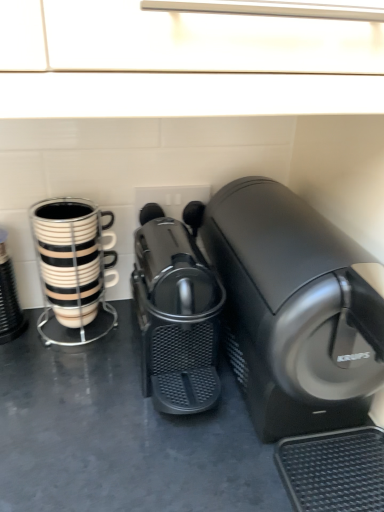
The image size is (384, 512). Find the location of `black glossy coffee cup at left`. black glossy coffee cup at left is located at coordinates (9, 298).

Identify the location of black and white striped mug at left. The height and width of the screenshot is (512, 384). (69, 259).

Based on the photo, how much space does black plastic coffee machine at center, which ranks as the 2th home appliance in right-to-left order, occupy horizontally?

12.50 inches.

The width and height of the screenshot is (384, 512). Identify the location of black glossy coffee cup at left. (9, 298).

Considering the sizes of objects black glossy coffee cup at left and black plastic coffee machine at center, which ranks as the 2th home appliance in right-to-left order, in the image provided, who is bigger, black glossy coffee cup at left or black plastic coffee machine at center, which ranks as the 2th home appliance in right-to-left order,?

Bigger between the two is black plastic coffee machine at center, which ranks as the 2th home appliance in right-to-left order.

Is black glossy coffee cup at left thinner than black plastic coffee machine at center, which ranks as the 2th home appliance in right-to-left order?

Yes.

Considering the points (6, 309) and (191, 359), which point is in front, point (6, 309) or point (191, 359)?

Point (191, 359)

Find the location of a particular element. The height and width of the screenshot is (512, 384). home appliance that is the 1st one above the black glossy coffee cup at left (from a real-world perspective) is located at coordinates (176, 312).

Would you say black plastic coffee machine at center, which ranks as the 2th home appliance in right-to-left order, is outside black plastic coffee machine at center, marked as the first home appliance in a right-to-left arrangement?

Yes, black plastic coffee machine at center, which ranks as the 2th home appliance in right-to-left order, is outside of black plastic coffee machine at center, marked as the first home appliance in a right-to-left arrangement.

Is black plastic coffee machine at center, which ranks as the 2th home appliance in right-to-left order, bigger or smaller than black plastic coffee machine at center, marked as the first home appliance in a right-to-left arrangement?

In the image, black plastic coffee machine at center, which ranks as the 2th home appliance in right-to-left order, appears to be smaller than black plastic coffee machine at center, marked as the first home appliance in a right-to-left arrangement.

Which point is more forward, (212, 289) or (348, 398)?

Positioned in front is point (348, 398).

Based on their positions, is black plastic coffee machine at center, which ranks as the 2th home appliance in right-to-left order, located to the left or right of black plastic coffee machine at center, the 2th home appliance positioned from the left?

black plastic coffee machine at center, which ranks as the 2th home appliance in right-to-left order, is to the left of black plastic coffee machine at center, the 2th home appliance positioned from the left.

From the picture: From the image's perspective, is black plastic coffee machine at center, which ranks as the 2th home appliance in right-to-left order, above or below black and white striped mug at left?

Clearly, from the image's perspective, black plastic coffee machine at center, which ranks as the 2th home appliance in right-to-left order, is below black and white striped mug at left.

From the picture: Considering the relative sizes of black plastic coffee machine at center, which ranks as the 2th home appliance in right-to-left order, and black and white striped mug at left in the image provided, is black plastic coffee machine at center, which ranks as the 2th home appliance in right-to-left order, thinner than black and white striped mug at left?

In fact, black plastic coffee machine at center, which ranks as the 2th home appliance in right-to-left order, might be wider than black and white striped mug at left.

At what (x,y) coordinates should I click in order to perform the action: click on coffee cup behind the black plastic coffee machine at center, the 1th home appliance in the left-to-right sequence. Please return your answer as a coordinate pair (x, y). Looking at the image, I should click on click(69, 259).

Is point (3, 319) positioned behind point (65, 218)?

Yes, it is.

Based on their sizes in the image, would you say black glossy coffee cup at left is bigger or smaller than black and white striped mug at left?

black glossy coffee cup at left is smaller than black and white striped mug at left.

Consider the image. From a real-world perspective, is black glossy coffee cup at left physically below black and white striped mug at left?

Yes, from a real-world perspective, black glossy coffee cup at left is below black and white striped mug at left.

Which is more to the right, black glossy coffee cup at left or black and white striped mug at left?

black and white striped mug at left.

From the image's perspective, relative to black plastic coffee machine at center, the 1th home appliance in the left-to-right sequence, is black and white striped mug at left above or below?

Clearly, from the image's perspective, black and white striped mug at left is above black plastic coffee machine at center, the 1th home appliance in the left-to-right sequence.

From a real-world perspective, does black and white striped mug at left sit lower than black plastic coffee machine at center, which ranks as the 2th home appliance in right-to-left order?

Correct, in the physical world, black and white striped mug at left is lower than black plastic coffee machine at center, which ranks as the 2th home appliance in right-to-left order.

Considering the relative positions of black and white striped mug at left and black plastic coffee machine at center, which ranks as the 2th home appliance in right-to-left order, in the image provided, is black and white striped mug at left to the right of black plastic coffee machine at center, which ranks as the 2th home appliance in right-to-left order, from the viewer's perspective?

Incorrect, black and white striped mug at left is not on the right side of black plastic coffee machine at center, which ranks as the 2th home appliance in right-to-left order.

Based on the photo, considering the sizes of objects black and white striped mug at left and black plastic coffee machine at center, the 1th home appliance in the left-to-right sequence, in the image provided, who is wider, black and white striped mug at left or black plastic coffee machine at center, the 1th home appliance in the left-to-right sequence,?

With larger width is black plastic coffee machine at center, the 1th home appliance in the left-to-right sequence.

Which is in front, point (95, 263) or point (6, 307)?

The point (95, 263) is more forward.

Locate an element on the screen. The image size is (384, 512). appliance to the left of black and white striped mug at left is located at coordinates (9, 298).

Can you confirm if black and white striped mug at left is thinner than black glossy coffee cup at left?

Correct, the width of black and white striped mug at left is less than that of black glossy coffee cup at left.

Does black and white striped mug at left have a lesser height compared to black glossy coffee cup at left?

Incorrect, the height of black and white striped mug at left does not fall short of that of black glossy coffee cup at left.

From the image's perspective, who appears lower, black plastic coffee machine at center, marked as the first home appliance in a right-to-left arrangement, or black glossy coffee cup at left?

black glossy coffee cup at left.

From a real-world perspective, is black plastic coffee machine at center, the 2th home appliance positioned from the left, positioned over black glossy coffee cup at left based on gravity?

Yes.

Does point (344, 419) appear closer or farther from the camera than point (4, 318)?

Point (344, 419) is closer to the camera than point (4, 318).

Considering the sizes of objects black plastic coffee machine at center, the 2th home appliance positioned from the left, and black glossy coffee cup at left in the image provided, who is smaller, black plastic coffee machine at center, the 2th home appliance positioned from the left, or black glossy coffee cup at left?

Smaller between the two is black glossy coffee cup at left.

This screenshot has height=512, width=384. Find the location of `home appliance below the black glossy coffee cup at left (from the image's perspective)`. home appliance below the black glossy coffee cup at left (from the image's perspective) is located at coordinates (176, 312).

Where is `home appliance that appears above the black plastic coffee machine at center, the 1th home appliance in the left-to-right sequence (from a real-world perspective)`? The width and height of the screenshot is (384, 512). home appliance that appears above the black plastic coffee machine at center, the 1th home appliance in the left-to-right sequence (from a real-world perspective) is located at coordinates (303, 339).

Which object lies nearer to the anchor point black glossy coffee cup at left, black plastic coffee machine at center, marked as the first home appliance in a right-to-left arrangement, or black and white striped mug at left?

black and white striped mug at left is positioned closer to the anchor black glossy coffee cup at left.

Looking at the image, which one is located closer to black plastic coffee machine at center, the 2th home appliance positioned from the left, black plastic coffee machine at center, the 1th home appliance in the left-to-right sequence, or black and white striped mug at left?

black plastic coffee machine at center, the 1th home appliance in the left-to-right sequence.

Looking at the image, which one is located further to black plastic coffee machine at center, the 2th home appliance positioned from the left, black and white striped mug at left or black plastic coffee machine at center, the 1th home appliance in the left-to-right sequence?

The object further to black plastic coffee machine at center, the 2th home appliance positioned from the left, is black and white striped mug at left.

When comparing their distances from black glossy coffee cup at left, does black and white striped mug at left or black plastic coffee machine at center, which ranks as the 2th home appliance in right-to-left order, seem closer?

black and white striped mug at left is positioned closer to the anchor black glossy coffee cup at left.

Which object lies nearer to the anchor point black plastic coffee machine at center, which ranks as the 2th home appliance in right-to-left order, black plastic coffee machine at center, marked as the first home appliance in a right-to-left arrangement, or black and white striped mug at left?

Based on the image, black plastic coffee machine at center, marked as the first home appliance in a right-to-left arrangement, appears to be nearer to black plastic coffee machine at center, which ranks as the 2th home appliance in right-to-left order.

Considering their positions, is black plastic coffee machine at center, marked as the first home appliance in a right-to-left arrangement, positioned further to black and white striped mug at left than black plastic coffee machine at center, which ranks as the 2th home appliance in right-to-left order?

black plastic coffee machine at center, marked as the first home appliance in a right-to-left arrangement, is further to black and white striped mug at left.

Estimate the real-world distances between objects in this image. Which object is closer to black and white striped mug at left, black plastic coffee machine at center, the 1th home appliance in the left-to-right sequence, or black plastic coffee machine at center, marked as the first home appliance in a right-to-left arrangement?

black plastic coffee machine at center, the 1th home appliance in the left-to-right sequence, lies closer to black and white striped mug at left than the other object.

From the image, which object appears to be nearer to black plastic coffee machine at center, marked as the first home appliance in a right-to-left arrangement, black plastic coffee machine at center, the 1th home appliance in the left-to-right sequence, or black glossy coffee cup at left?

The object closer to black plastic coffee machine at center, marked as the first home appliance in a right-to-left arrangement, is black plastic coffee machine at center, the 1th home appliance in the left-to-right sequence.

Identify the location of home appliance between black plastic coffee machine at center, the 2th home appliance positioned from the left, and black and white striped mug at left from front to back. (176, 312).

Locate an element on the screen. coffee cup between black glossy coffee cup at left and black plastic coffee machine at center, the 1th home appliance in the left-to-right sequence is located at coordinates (69, 259).

Where is `coffee cup between black glossy coffee cup at left and black plastic coffee machine at center, the 2th home appliance positioned from the left, in the horizontal direction`? The height and width of the screenshot is (512, 384). coffee cup between black glossy coffee cup at left and black plastic coffee machine at center, the 2th home appliance positioned from the left, in the horizontal direction is located at coordinates (69, 259).

This screenshot has width=384, height=512. What are the coordinates of `home appliance between black glossy coffee cup at left and black plastic coffee machine at center, marked as the first home appliance in a right-to-left arrangement, in the horizontal direction` in the screenshot? It's located at (176, 312).